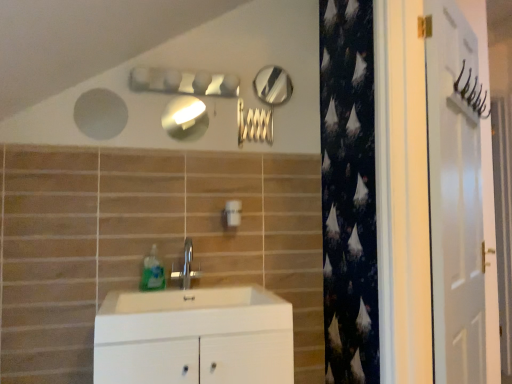
Question: Can you confirm if silver metallic faucet at center is thinner than matte silver mirror at upper center, the second mirror when ordered from top to bottom?

Choices:
 (A) no
 (B) yes

Answer: (A)

Question: Is silver metallic faucet at center to the left of matte silver mirror at upper center, which is the first mirror from bottom to top, from the viewer's perspective?

Choices:
 (A) no
 (B) yes

Answer: (A)

Question: Does silver metallic faucet at center lie in front of matte silver mirror at upper center, which is the first mirror from bottom to top?

Choices:
 (A) no
 (B) yes

Answer: (B)

Question: Is silver metallic faucet at center located outside matte silver mirror at upper center, the second mirror when ordered from top to bottom?

Choices:
 (A) no
 (B) yes

Answer: (B)

Question: Considering the relative sizes of silver metallic faucet at center and matte silver mirror at upper center, the 2th mirror from the back, in the image provided, is silver metallic faucet at center wider than matte silver mirror at upper center, the 2th mirror from the back,?

Choices:
 (A) no
 (B) yes

Answer: (B)

Question: Is silver metallic faucet at center surrounding matte silver mirror at upper center, arranged as the second mirror when viewed from the right?

Choices:
 (A) yes
 (B) no

Answer: (B)

Question: From the image's perspective, is translucent plastic soap dispenser at sink on top of silver metallic faucet at center?

Choices:
 (A) yes
 (B) no

Answer: (A)

Question: From a real-world perspective, is translucent plastic soap dispenser at sink physically above silver metallic faucet at center?

Choices:
 (A) no
 (B) yes

Answer: (A)

Question: Is translucent plastic soap dispenser at sink placed right next to silver metallic faucet at center?

Choices:
 (A) yes
 (B) no

Answer: (A)

Question: Is translucent plastic soap dispenser at sink wider than silver metallic faucet at center?

Choices:
 (A) no
 (B) yes

Answer: (B)

Question: Is the position of translucent plastic soap dispenser at sink more distant than that of silver metallic faucet at center?

Choices:
 (A) yes
 (B) no

Answer: (B)

Question: Would you consider translucent plastic soap dispenser at sink to be distant from silver metallic faucet at center?

Choices:
 (A) yes
 (B) no

Answer: (B)

Question: Is white plastic light switch at center not inside matte silver mirror at upper center, arranged as the second mirror when viewed from the right?

Choices:
 (A) no
 (B) yes

Answer: (B)